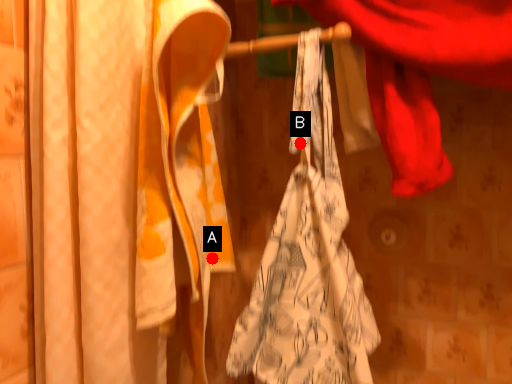
Question: Two points are circled on the image, labeled by A and B beside each circle. Which of the following is the farthest from the observer?

Choices:
 (A) A is further
 (B) B is further

Answer: (A)